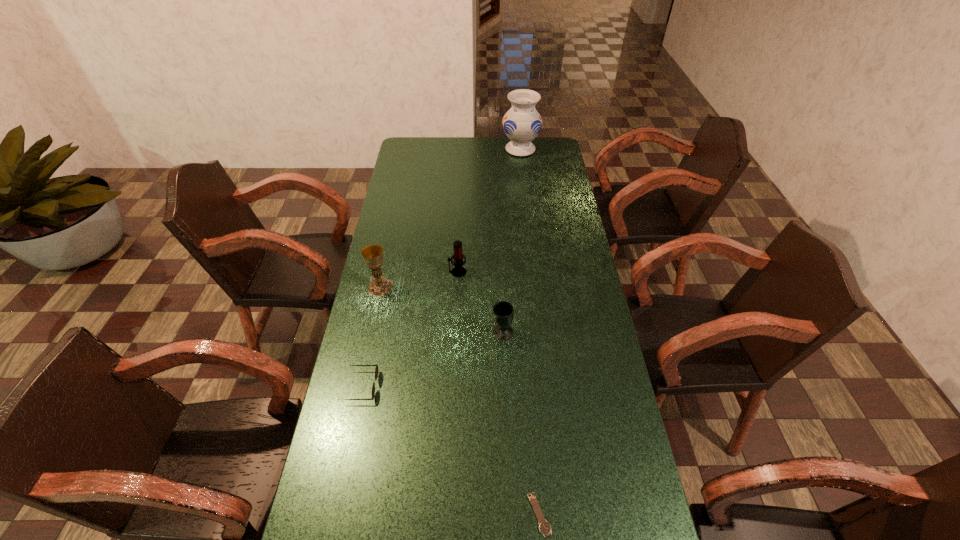
Where is `free space between the third farthest object and the nearer chalice`? The image size is (960, 540). free space between the third farthest object and the nearer chalice is located at coordinates (442, 310).

Locate an element on the screen. free space between the third shortest object and the tallest object is located at coordinates (512, 241).

At what (x,y) coordinates should I click in order to perform the action: click on free area in between the nearest object and the second shortest object. Please return your answer as a coordinate pair (x, y). The width and height of the screenshot is (960, 540). Looking at the image, I should click on (450, 450).

Locate an element on the screen. This screenshot has height=540, width=960. free space between the shorter chalice and the third object from left to right is located at coordinates (480, 302).

The image size is (960, 540). Identify the location of free spot between the farther chalice and the microphone. (419, 280).

Where is `vacant space that is in between the farthest object and the nearer chalice`? The height and width of the screenshot is (540, 960). vacant space that is in between the farthest object and the nearer chalice is located at coordinates [x=512, y=241].

The image size is (960, 540). Find the location of `blank region between the third farthest object and the right chalice`. blank region between the third farthest object and the right chalice is located at coordinates (442, 310).

I want to click on empty space between the shortest object and the fourth tallest object, so click(521, 423).

Identify the location of the second closest object relative to the shorter chalice. This screenshot has height=540, width=960. (376, 370).

Where is `object that can be found as the fourth closest to the second tallest object`? object that can be found as the fourth closest to the second tallest object is located at coordinates (544, 527).